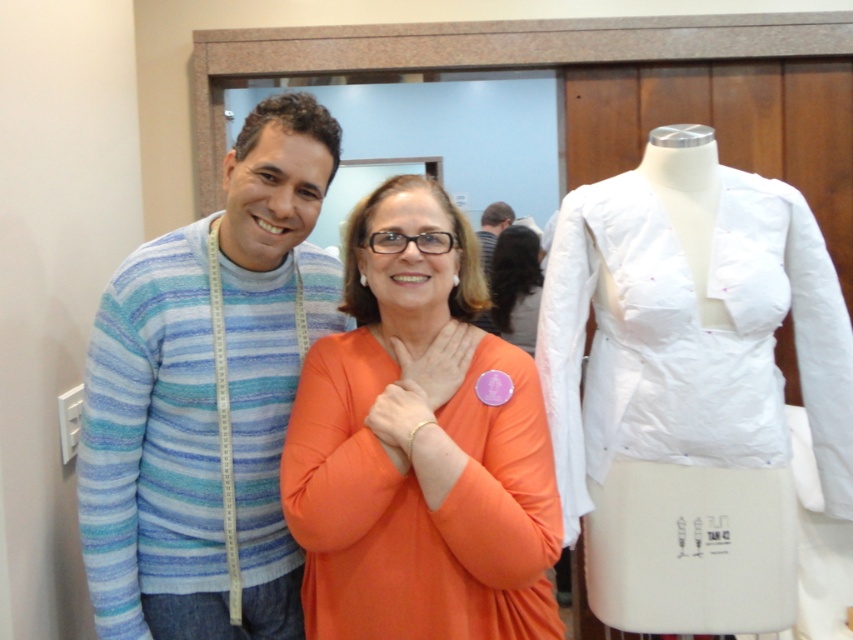
Question: In this image, where is orange matte shirt at center located relative to orange fabric blouse at center?

Choices:
 (A) right
 (B) left

Answer: (B)

Question: Which of the following is the closest to the observer?

Choices:
 (A) (119, 436)
 (B) (503, 220)
 (C) (521, 260)

Answer: (A)

Question: Which of the following is the closest to the observer?

Choices:
 (A) orange matte shirt at center
 (B) striped fabric shirt at upper center
 (C) striped cotton sweater at center

Answer: (A)

Question: Which object is farther from the camera taking this photo?

Choices:
 (A) striped cotton sweater at center
 (B) orange fabric blouse at center

Answer: (B)

Question: Can you confirm if striped cotton sweater at center is positioned above orange fabric blouse at center?

Choices:
 (A) yes
 (B) no

Answer: (B)

Question: Does striped cotton sweater at center appear on the left side of striped fabric shirt at upper center?

Choices:
 (A) no
 (B) yes

Answer: (B)